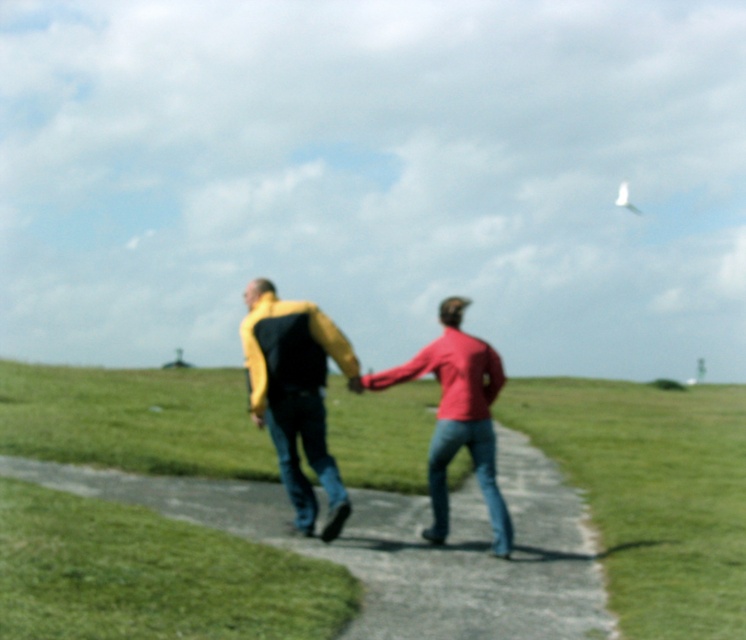
Question: Among these points, which one is farthest from the camera?

Choices:
 (A) (269, 397)
 (B) (59, 404)

Answer: (B)

Question: Which of the following is the closest to the observer?

Choices:
 (A) yellow fabric jacket at center
 (B) yellow matte jacket at center
 (C) green grass at center

Answer: (C)

Question: Is green grass at center below yellow fabric jacket at center?

Choices:
 (A) no
 (B) yes

Answer: (B)

Question: Does yellow fabric jacket at center appear on the right side of yellow matte jacket at center?

Choices:
 (A) no
 (B) yes

Answer: (B)

Question: Is green grass at center in front of yellow matte jacket at center?

Choices:
 (A) yes
 (B) no

Answer: (A)

Question: Among these objects, which one is nearest to the camera?

Choices:
 (A) yellow matte jacket at center
 (B) yellow fabric jacket at center

Answer: (B)